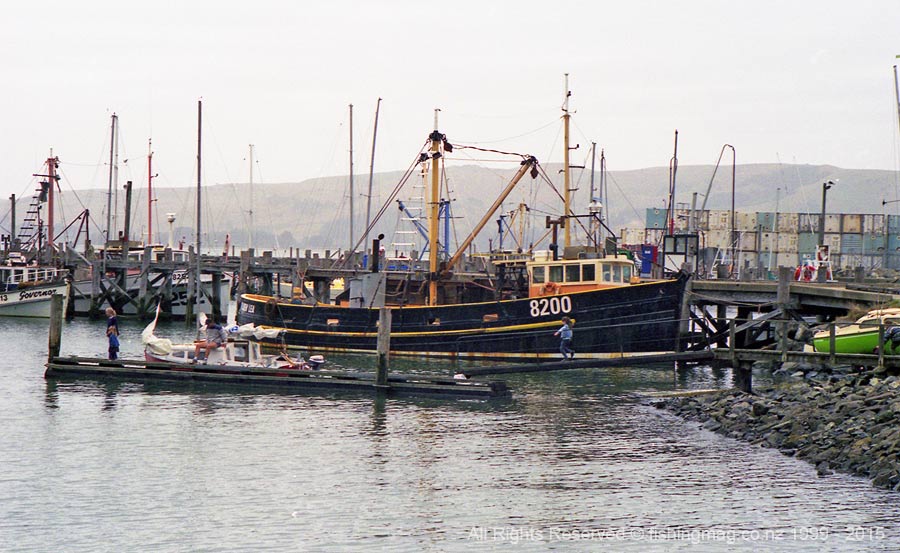
This screenshot has height=553, width=900. What are the coordinates of `the front window` in the screenshot? It's located at (607, 275), (616, 275), (623, 267).